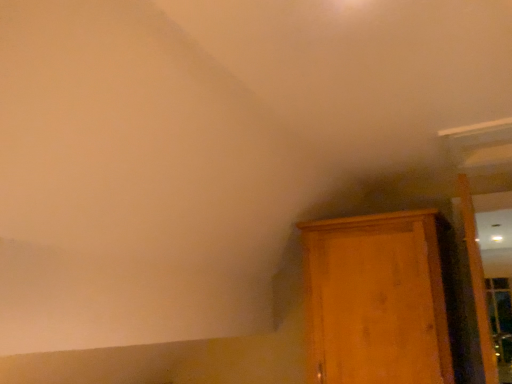
Question: Is wooden door at right at the left side of wooden cabinet at right?

Choices:
 (A) yes
 (B) no

Answer: (B)

Question: Considering the relative sizes of wooden door at right and wooden cabinet at right in the image provided, is wooden door at right taller than wooden cabinet at right?

Choices:
 (A) yes
 (B) no

Answer: (A)

Question: From a real-world perspective, is wooden door at right beneath wooden cabinet at right?

Choices:
 (A) yes
 (B) no

Answer: (B)

Question: From a real-world perspective, is wooden door at right on top of wooden cabinet at right?

Choices:
 (A) no
 (B) yes

Answer: (B)

Question: Can you confirm if wooden door at right is wider than wooden cabinet at right?

Choices:
 (A) no
 (B) yes

Answer: (A)

Question: Is the surface of wooden door at right in direct contact with wooden cabinet at right?

Choices:
 (A) no
 (B) yes

Answer: (A)

Question: Considering the relative sizes of wooden cabinet at right and wooden door at right in the image provided, is wooden cabinet at right bigger than wooden door at right?

Choices:
 (A) yes
 (B) no

Answer: (A)

Question: From a real-world perspective, is wooden cabinet at right over wooden door at right?

Choices:
 (A) no
 (B) yes

Answer: (A)

Question: Is wooden cabinet at right wider than wooden door at right?

Choices:
 (A) no
 (B) yes

Answer: (B)

Question: Would you say wooden cabinet at right is outside wooden door at right?

Choices:
 (A) no
 (B) yes

Answer: (B)

Question: From the image's perspective, does wooden cabinet at right appear lower than wooden door at right?

Choices:
 (A) no
 (B) yes

Answer: (B)

Question: Is wooden cabinet at right with wooden door at right?

Choices:
 (A) no
 (B) yes

Answer: (A)

Question: From a real-world perspective, is wooden cabinet at right physically located above or below wooden door at right?

Choices:
 (A) below
 (B) above

Answer: (A)